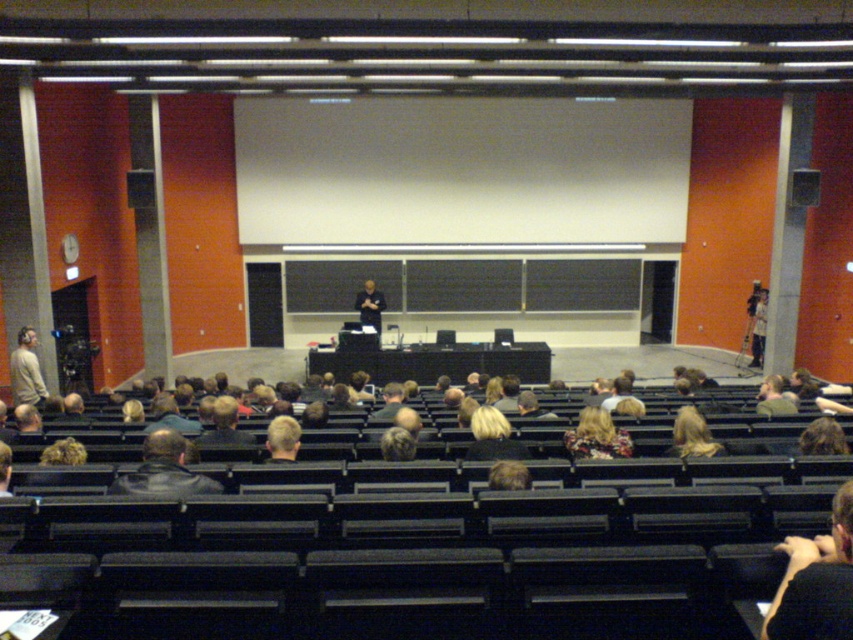
Question: Which of the following is the farthest from the observer?

Choices:
 (A) leather jacket at lower left
 (B) dark brown leather jacket at lower right

Answer: (A)

Question: Is dark brown leather jacket at lower right above leather jacket at lower left?

Choices:
 (A) no
 (B) yes

Answer: (A)

Question: Can you confirm if dark brown leather jacket at lower right is positioned below leather jacket at lower left?

Choices:
 (A) yes
 (B) no

Answer: (A)

Question: Among these points, which one is nearest to the camera?

Choices:
 (A) (144, 442)
 (B) (804, 566)

Answer: (B)

Question: Does dark brown leather jacket at lower right appear under leather jacket at lower left?

Choices:
 (A) no
 (B) yes

Answer: (B)